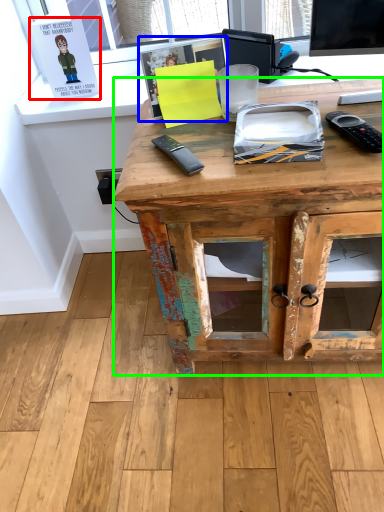
Question: Which object is positioned farthest from book (highlighted by a red box)? Select from book (highlighted by a blue box) and desk (highlighted by a green box).

Choices:
 (A) book
 (B) desk

Answer: (B)